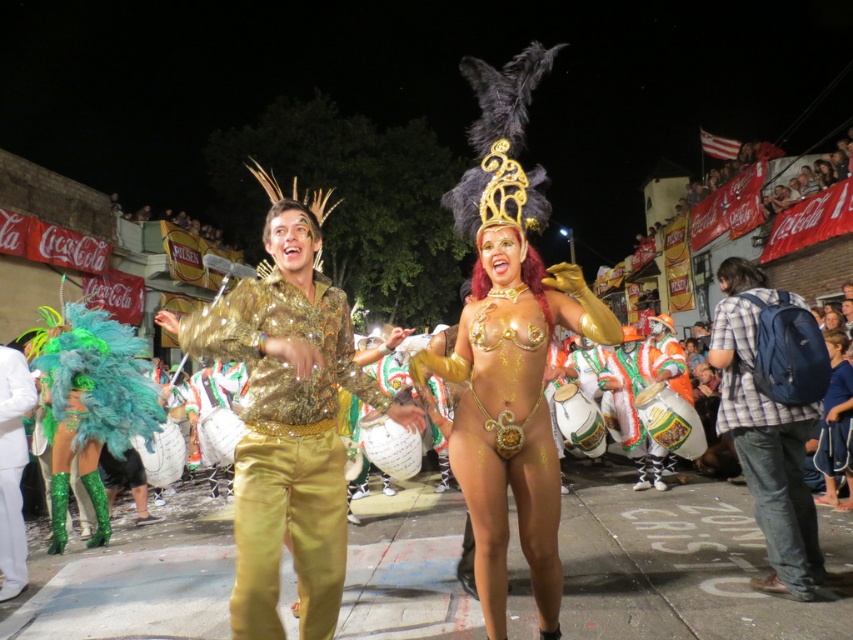
Is gold metallic bikini at center below blue fabric backpack at right?

Incorrect, gold metallic bikini at center is not positioned below blue fabric backpack at right.

Where is `gold metallic bikini at center`? This screenshot has width=853, height=640. gold metallic bikini at center is located at coordinates (509, 380).

Is blue fabric backpack at right to the right of green feather boa at left from the viewer's perspective?

Indeed, blue fabric backpack at right is positioned on the right side of green feather boa at left.

Is blue fabric backpack at right closer to the viewer compared to green feather boa at left?

Yes, blue fabric backpack at right is in front of green feather boa at left.

The width and height of the screenshot is (853, 640). What do you see at coordinates (766, 444) in the screenshot? I see `blue fabric backpack at right` at bounding box center [766, 444].

Where is `blue fabric backpack at right`? blue fabric backpack at right is located at coordinates (766, 444).

Does blue fabric backpack at right appear on the left side of blue fabric pants at lower right?

Indeed, blue fabric backpack at right is positioned on the left side of blue fabric pants at lower right.

Is blue fabric backpack at right to the right of blue fabric pants at lower right from the viewer's perspective?

No, blue fabric backpack at right is not to the right of blue fabric pants at lower right.

Who is more forward, [735,300] or [825,410]?

Point [735,300]

The width and height of the screenshot is (853, 640). What are the coordinates of `blue fabric backpack at right` in the screenshot? It's located at (766, 444).